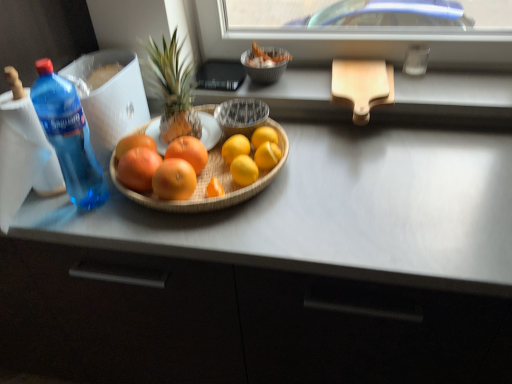
Question: From a real-world perspective, is blue translucent bottle at left physically located above or below green textured pineapple at center?

Choices:
 (A) below
 (B) above

Answer: (B)

Question: Would you say blue translucent bottle at left is to the left or to the right of green textured pineapple at center in the picture?

Choices:
 (A) right
 (B) left

Answer: (B)

Question: Which object is positioned farthest from the wooden cutting board at upper right?

Choices:
 (A) green textured pineapple at center
 (B) matte gray counter top at center
 (C) bamboo tray at center
 (D) orange matte grapefruit at center, positioned as the first grapefruit in left-to-right order
 (E) orange matte grapefruit at center, which is the fourth grapefruit from left to right

Answer: (D)

Question: Which object is positioned closest to the orange matte grapefruit at center, the fifth grapefruit when ordered from right to left?

Choices:
 (A) bamboo tray at center
 (B) orange matte grapefruit at center, arranged as the 3th grapefruit when viewed from the left
 (C) matte gray counter top at center
 (D) orange matte grapefruit at center, marked as the second grapefruit in a right-to-left arrangement
 (E) green textured pineapple at center

Answer: (B)